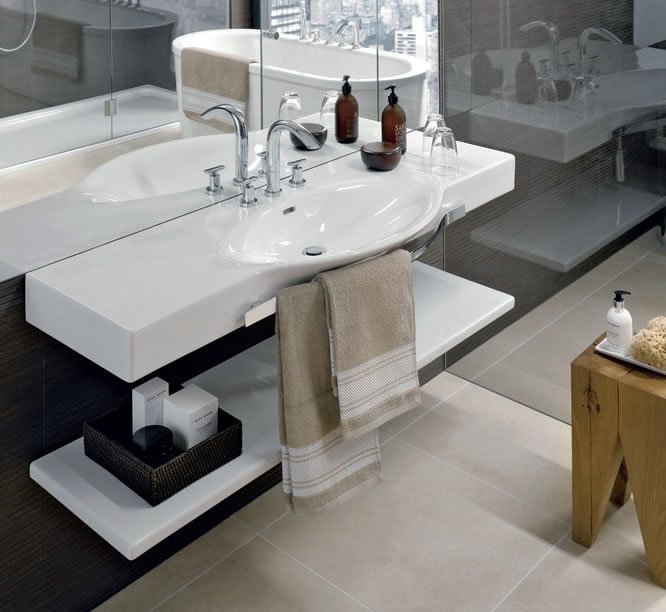
Locate an element on the screen. Image resolution: width=666 pixels, height=612 pixels. bathtub is located at coordinates click(x=306, y=43).